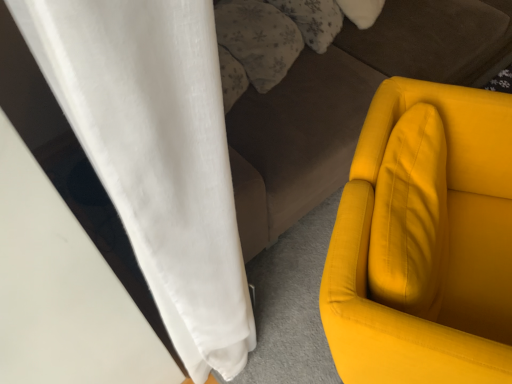
Question: Is fluffy white pillow at upper center, which is the second pillow in left-to-right order, at the left side of matte yellow armchair at right?

Choices:
 (A) yes
 (B) no

Answer: (A)

Question: Can you confirm if fluffy white pillow at upper center, which is the second pillow in left-to-right order, is shorter than matte yellow armchair at right?

Choices:
 (A) no
 (B) yes

Answer: (B)

Question: Is fluffy white pillow at upper center, positioned as the first pillow in right-to-left order, oriented away from matte yellow armchair at right?

Choices:
 (A) yes
 (B) no

Answer: (B)

Question: From the image's perspective, would you say fluffy white pillow at upper center, positioned as the first pillow in right-to-left order, is shown under matte yellow armchair at right?

Choices:
 (A) yes
 (B) no

Answer: (B)

Question: Does fluffy white pillow at upper center, positioned as the first pillow in right-to-left order, have a smaller size compared to matte yellow armchair at right?

Choices:
 (A) no
 (B) yes

Answer: (B)

Question: Does fluffy white pillow at upper center, positioned as the first pillow in right-to-left order, appear on the right side of matte yellow armchair at right?

Choices:
 (A) yes
 (B) no

Answer: (B)

Question: Considering the relative positions of velvet brown studio couch at center and fluffy white pillow at upper center, the 1th pillow in the left-to-right sequence, in the image provided, is velvet brown studio couch at center to the left of fluffy white pillow at upper center, the 1th pillow in the left-to-right sequence, from the viewer's perspective?

Choices:
 (A) no
 (B) yes

Answer: (A)

Question: Does velvet brown studio couch at center have a greater height compared to fluffy white pillow at upper center, the 1th pillow in the left-to-right sequence?

Choices:
 (A) no
 (B) yes

Answer: (B)

Question: Is velvet brown studio couch at center next to fluffy white pillow at upper center, the 1th pillow in the left-to-right sequence, and touching it?

Choices:
 (A) no
 (B) yes

Answer: (A)

Question: Does velvet brown studio couch at center turn towards fluffy white pillow at upper center, the 1th pillow in the left-to-right sequence?

Choices:
 (A) yes
 (B) no

Answer: (A)

Question: Would you say fluffy white pillow at upper center, the 1th pillow in the left-to-right sequence, is part of velvet brown studio couch at center's contents?

Choices:
 (A) yes
 (B) no

Answer: (A)

Question: Is velvet brown studio couch at center smaller than fluffy white pillow at upper center, the 1th pillow in the left-to-right sequence?

Choices:
 (A) no
 (B) yes

Answer: (A)

Question: From a real-world perspective, is velvet brown studio couch at center physically below fluffy white pillow at upper center, positioned as the first pillow in right-to-left order?

Choices:
 (A) no
 (B) yes

Answer: (B)